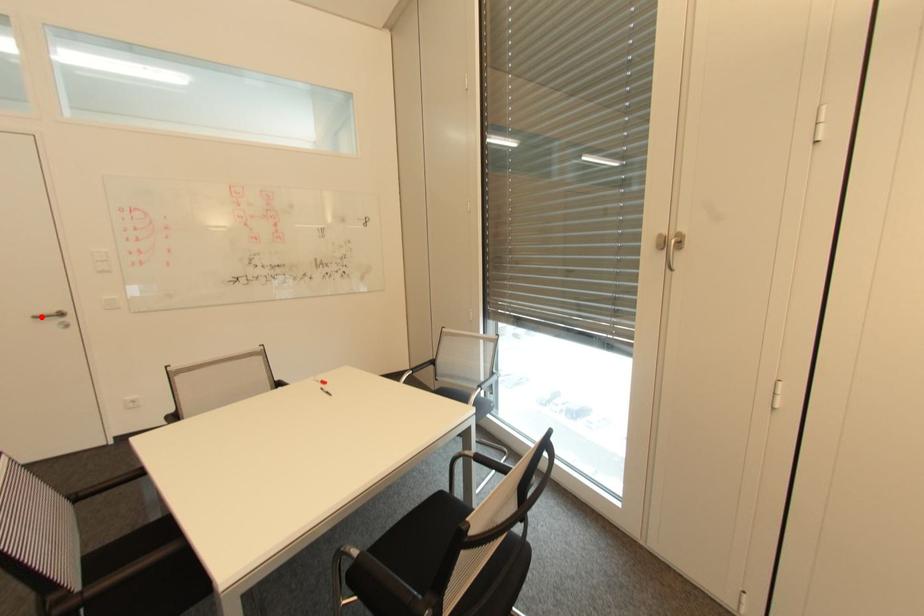
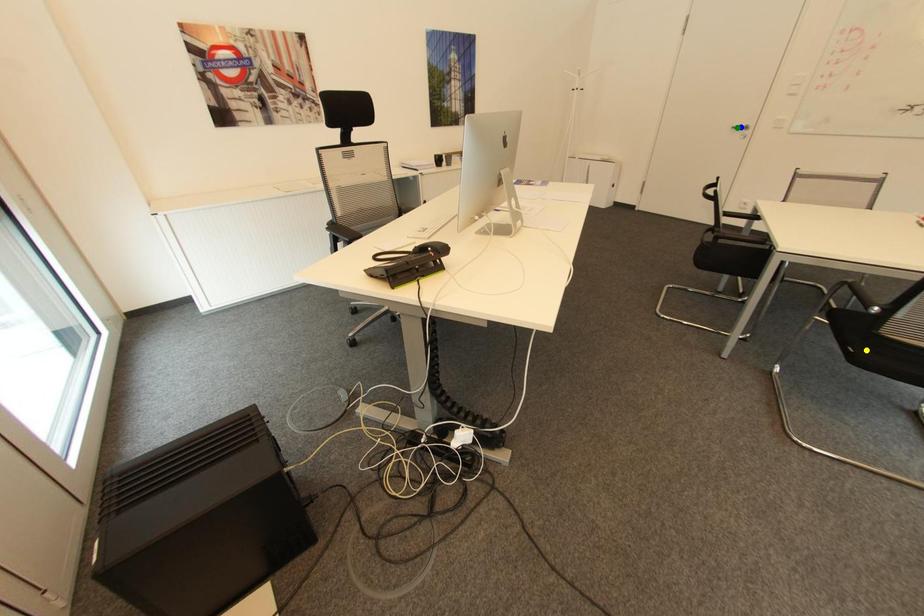
Question: I am providing you with two images of the same scene from different viewpoints. A red point is marked on the first image. You are given multiple points on the second image. Which spot in image 2 lines up with the point in image 1?

Choices:
 (A) blue point
 (B) yellow point
 (C) green point

Answer: (C)